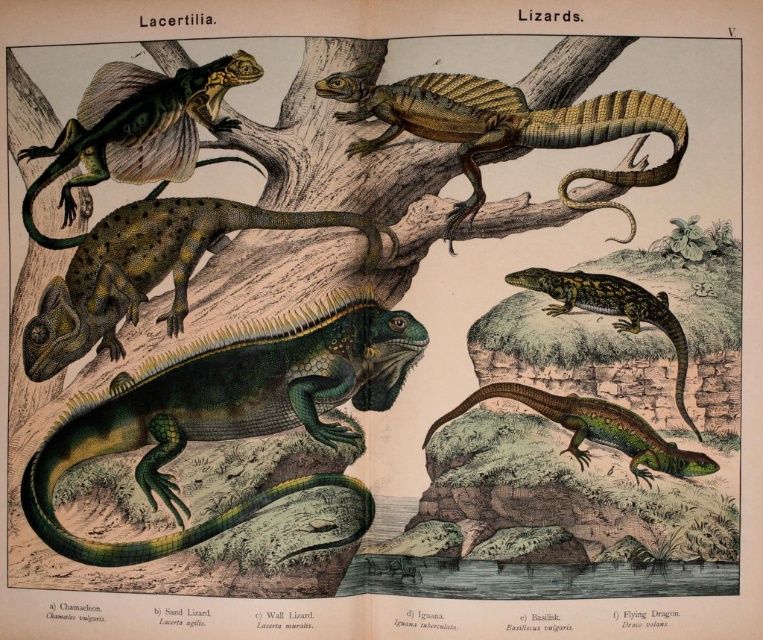
Question: Among these objects, which one is nearest to the camera?

Choices:
 (A) green glossy lizard at lower right
 (B) shiny green scales at upper center

Answer: (A)

Question: Does shiny green scales at upper left have a larger size compared to green glossy lizard at lower right?

Choices:
 (A) no
 (B) yes

Answer: (B)

Question: Is green scaly iguana at center further to camera compared to shiny green lizard at upper right?

Choices:
 (A) no
 (B) yes

Answer: (A)

Question: Which object is farther from the camera taking this photo?

Choices:
 (A) green glossy lizard at lower right
 (B) shiny green scales at upper left
 (C) shiny green lizard at upper right
 (D) green scaly iguana at center

Answer: (B)

Question: Does green scaly iguana at center come in front of shiny green scales at upper center?

Choices:
 (A) yes
 (B) no

Answer: (A)

Question: Which point appears closest to the camera in this image?

Choices:
 (A) 562,403
 (B) 105,148

Answer: (A)